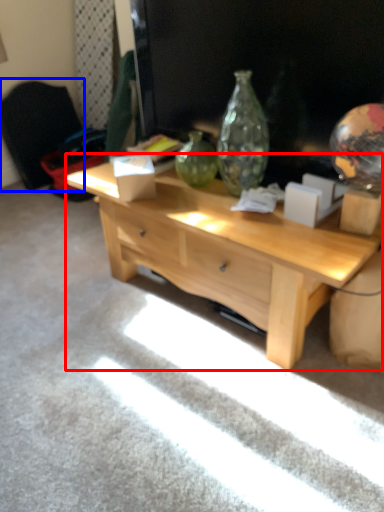
Question: Among these objects, which one is nearest to the camera, desk (highlighted by a red box) or armchair (highlighted by a blue box)?

Choices:
 (A) desk
 (B) armchair

Answer: (A)